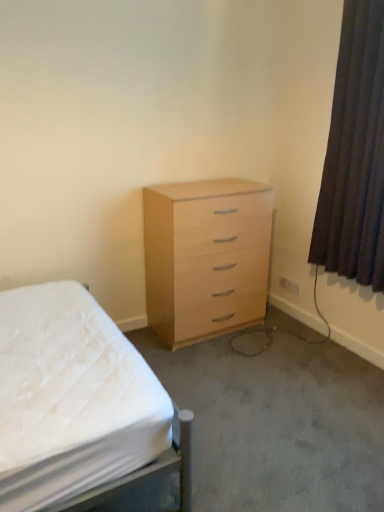
Question: From a real-world perspective, is dark brown fabric curtain at right over light wood/veneer chest of drawers at center?

Choices:
 (A) yes
 (B) no

Answer: (A)

Question: Considering the relative positions of dark brown fabric curtain at right and light wood/veneer chest of drawers at center in the image provided, is dark brown fabric curtain at right to the left of light wood/veneer chest of drawers at center from the viewer's perspective?

Choices:
 (A) no
 (B) yes

Answer: (A)

Question: From the image's perspective, does dark brown fabric curtain at right appear higher than light wood/veneer chest of drawers at center?

Choices:
 (A) yes
 (B) no

Answer: (A)

Question: Can you confirm if dark brown fabric curtain at right is taller than light wood/veneer chest of drawers at center?

Choices:
 (A) no
 (B) yes

Answer: (B)

Question: Is dark brown fabric curtain at right shorter than light wood/veneer chest of drawers at center?

Choices:
 (A) no
 (B) yes

Answer: (A)

Question: Is dark brown fabric curtain at right further to camera compared to light wood/veneer chest of drawers at center?

Choices:
 (A) yes
 (B) no

Answer: (B)

Question: From the image's perspective, is dark brown fabric curtain at right beneath white fabric bed at center?

Choices:
 (A) yes
 (B) no

Answer: (B)

Question: Are dark brown fabric curtain at right and white fabric bed at center making contact?

Choices:
 (A) yes
 (B) no

Answer: (B)

Question: Is dark brown fabric curtain at right taller than white fabric bed at center?

Choices:
 (A) no
 (B) yes

Answer: (B)

Question: Considering the relative positions of dark brown fabric curtain at right and white fabric bed at center in the image provided, is dark brown fabric curtain at right behind white fabric bed at center?

Choices:
 (A) no
 (B) yes

Answer: (B)

Question: From the image's perspective, does dark brown fabric curtain at right appear higher than white fabric bed at center?

Choices:
 (A) no
 (B) yes

Answer: (B)

Question: Is dark brown fabric curtain at right to the right of white fabric bed at center from the viewer's perspective?

Choices:
 (A) no
 (B) yes

Answer: (B)

Question: Is light wood/veneer chest of drawers at center smaller than dark brown fabric curtain at right?

Choices:
 (A) yes
 (B) no

Answer: (B)